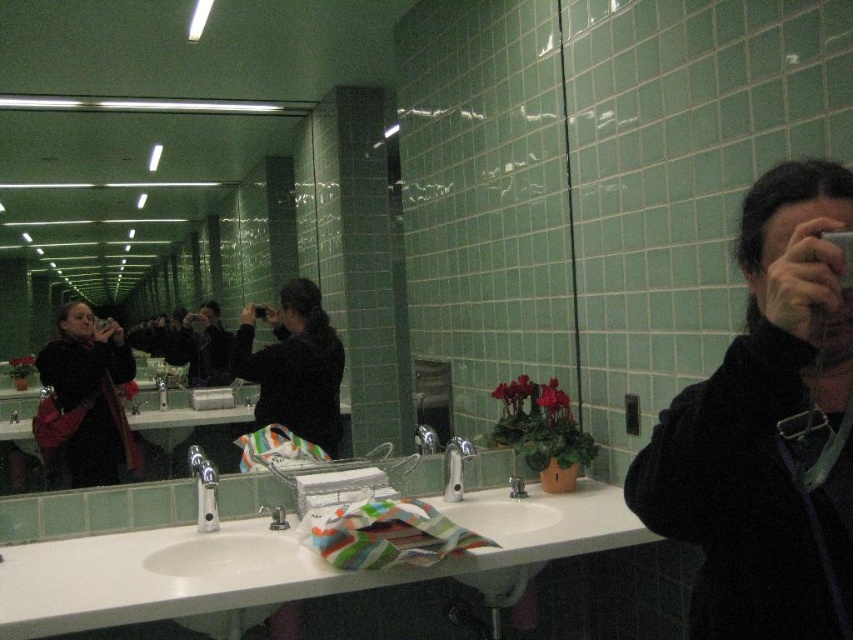
At what (x,y) coordinates should I click in order to perform the action: click on black fabric at right. Please return your answer as a coordinate pair (x, y). Image resolution: width=853 pixels, height=640 pixels. Looking at the image, I should click on (769, 429).

Does black fabric at right appear under white glossy sink at center?

No.

Does point (747, 317) come behind point (225, 564)?

No, (747, 317) is in front of (225, 564).

At what (x,y) coordinates should I click in order to perform the action: click on black fabric at right. Please return your answer as a coordinate pair (x, y). This screenshot has height=640, width=853. Looking at the image, I should click on (769, 429).

Does white ceramic sink at center have a greater width compared to silver metallic faucet at sink left?

Correct, the width of white ceramic sink at center exceeds that of silver metallic faucet at sink left.

Is point (485, 509) positioned before point (196, 483)?

No, it is not.

Does point (480, 493) lie in front of point (200, 470)?

No, (480, 493) is behind (200, 470).

The image size is (853, 640). What are the coordinates of `white ceramic sink at center` in the screenshot? It's located at (483, 496).

Does matte black jacket at left have a larger size compared to brushed metal faucet at sink left?

Indeed, matte black jacket at left has a larger size compared to brushed metal faucet at sink left.

Does matte black jacket at left appear on the right side of brushed metal faucet at sink left?

No, matte black jacket at left is not to the right of brushed metal faucet at sink left.

This screenshot has width=853, height=640. What are the coordinates of `matte black jacket at left` in the screenshot? It's located at (85, 397).

Locate an element on the screen. Image resolution: width=853 pixels, height=640 pixels. matte black jacket at left is located at coordinates (85, 397).